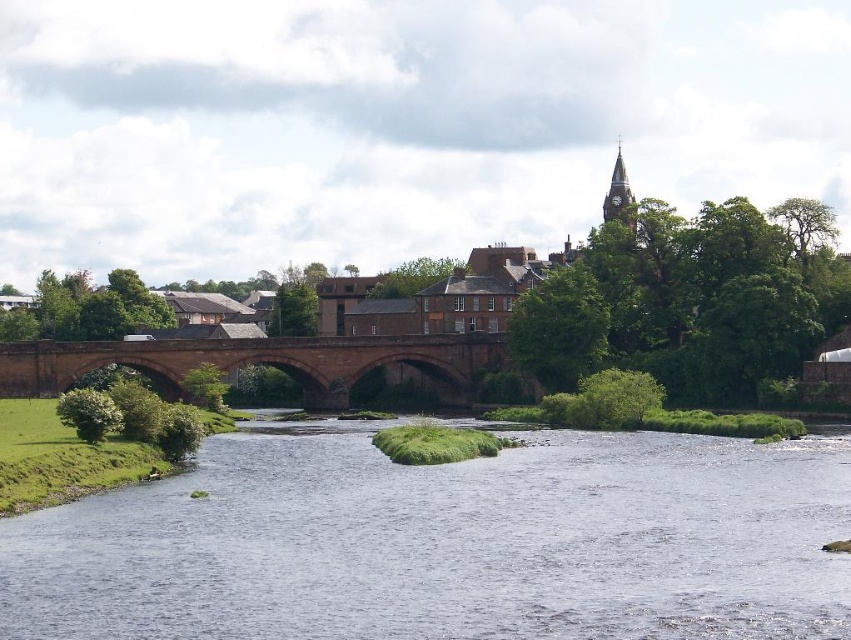
Who is positioned more to the right, clear water at center or matte stone bridge at center?

clear water at center is more to the right.

Which is in front, point (198, 460) or point (112, 349)?

Point (198, 460) is in front.

I want to click on clear water at center, so click(x=447, y=541).

Can you confirm if clear water at center is taller than matte brick bridge at center?

In fact, clear water at center may be shorter than matte brick bridge at center.

Describe the element at coordinates (447, 541) in the screenshot. This screenshot has width=851, height=640. I see `clear water at center` at that location.

Is point (537, 461) behind point (749, 257)?

No, (537, 461) is closer to viewer.

The width and height of the screenshot is (851, 640). What are the coordinates of `clear water at center` in the screenshot? It's located at (447, 541).

Where is `matte brick bridge at center`? matte brick bridge at center is located at coordinates (558, 308).

Who is taller, matte brick bridge at center or matte stone bridge at center?

With more height is matte brick bridge at center.

Based on the photo, measure the distance between point (627,316) and camera.

Point (627,316) is 133.50 meters from camera.

You are a GUI agent. You are given a task and a screenshot of the screen. Output one action in this format:
    pyautogui.click(x=<x>, y=<y>)
    Task: Click on the matte brick bridge at center
    This screenshot has width=851, height=640.
    Given the screenshot: What is the action you would take?
    pyautogui.click(x=558, y=308)